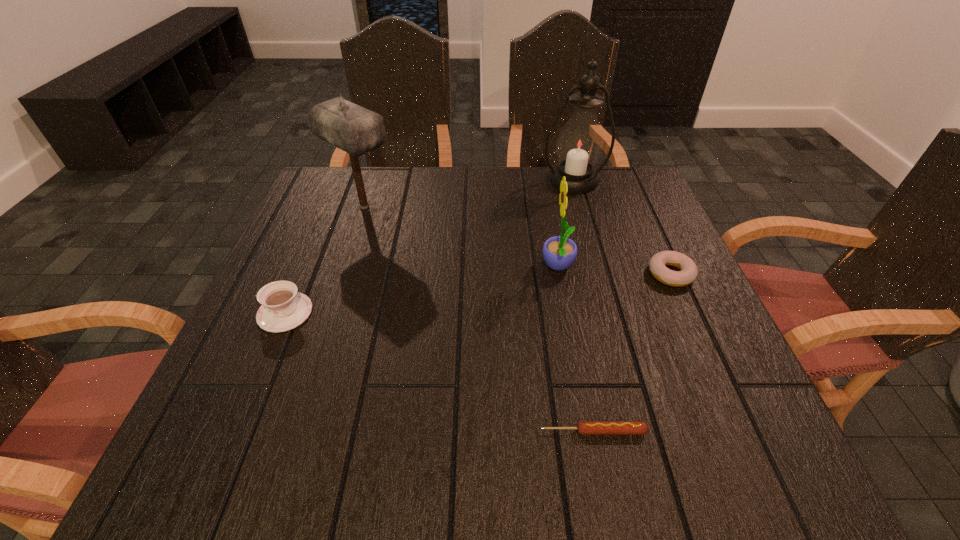
Locate an element on the screen. free space located 0.220m on the right of the mallet is located at coordinates (482, 207).

At what (x,y) coordinates should I click in order to perform the action: click on free spot located 0.220m on the front-facing side of the sunflower. Please return your answer as a coordinate pair (x, y). Looking at the image, I should click on (444, 267).

I want to click on vacant area situated on the front-facing side of the sunflower, so click(368, 267).

The image size is (960, 540). I want to click on vacant space located 0.320m on the front-facing side of the sunflower, so click(x=398, y=267).

At what (x,y) coordinates should I click in order to perform the action: click on free location located 0.370m on the left of the fifth tallest object. Please return your answer as a coordinate pair (x, y). The width and height of the screenshot is (960, 540). Looking at the image, I should click on pyautogui.click(x=480, y=274).

The width and height of the screenshot is (960, 540). I want to click on free space located on the left of the sausage, so click(429, 431).

Where is `oil lamp positioned at the far edge`? The image size is (960, 540). oil lamp positioned at the far edge is located at coordinates (580, 142).

Locate an element on the screen. mallet situated at the far edge is located at coordinates (356, 130).

This screenshot has height=540, width=960. In order to click on object positioned at the near edge in this screenshot , I will do `click(583, 427)`.

This screenshot has width=960, height=540. I want to click on mallet located at the left edge, so click(356, 130).